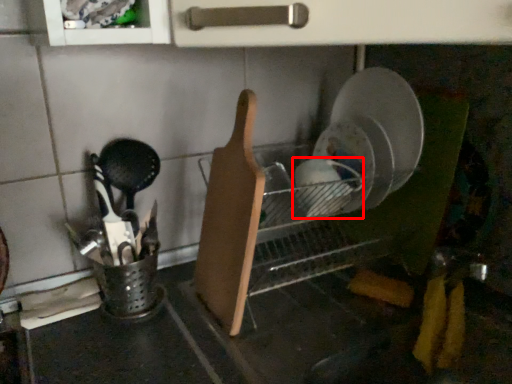
Question: Where is tableware (annotated by the red box) located in relation to cutting board in the image?

Choices:
 (A) left
 (B) right

Answer: (B)